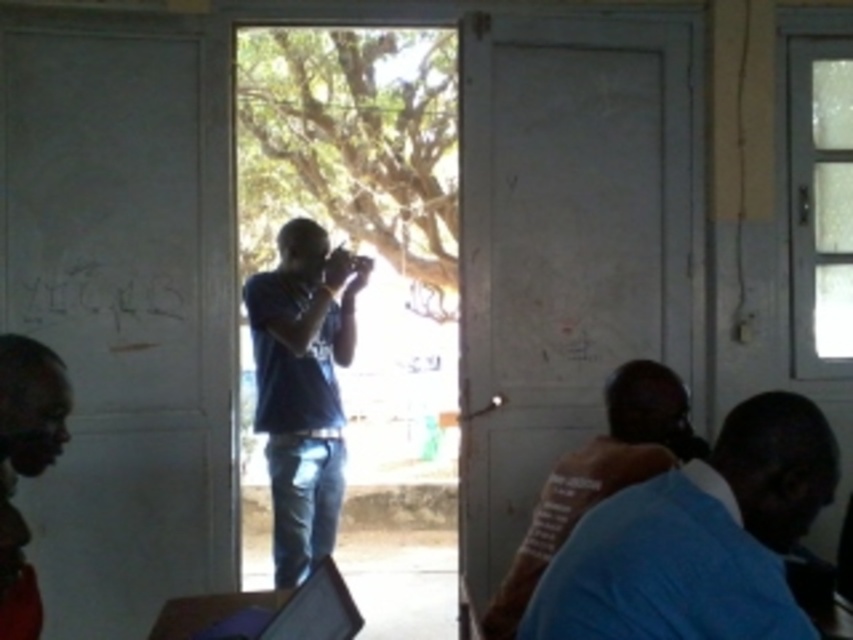
Which is more to the left, blue cotton shirt at lower right or dark red shirt at lower left?

From the viewer's perspective, dark red shirt at lower left appears more on the left side.

Does blue cotton shirt at lower right have a smaller size compared to dark red shirt at lower left?

Incorrect, blue cotton shirt at lower right is not smaller in size than dark red shirt at lower left.

Which is behind, point (809, 412) or point (21, 406)?

Positioned behind is point (21, 406).

Where is `blue cotton shirt at lower right`? blue cotton shirt at lower right is located at coordinates (698, 538).

Which is more to the left, blue denim jeans at center or dark red shirt at lower left?

From the viewer's perspective, dark red shirt at lower left appears more on the left side.

In the scene shown: Who is higher up, blue denim jeans at center or dark red shirt at lower left?

blue denim jeans at center is higher up.

Is point (274, 353) positioned after point (47, 440)?

Yes, it is.

At what (x,y) coordinates should I click in order to perform the action: click on blue denim jeans at center. Please return your answer as a coordinate pair (x, y). The image size is (853, 640). Looking at the image, I should click on (302, 387).

Which is below, blue denim jeans at center or matte black laptop at lower left?

Positioned lower is matte black laptop at lower left.

Can you confirm if blue denim jeans at center is shorter than matte black laptop at lower left?

In fact, blue denim jeans at center may be taller than matte black laptop at lower left.

Who is more distant from viewer, (314, 230) or (314, 595)?

The point (314, 230) is behind.

This screenshot has width=853, height=640. What are the coordinates of `blue denim jeans at center` in the screenshot? It's located at (302, 387).